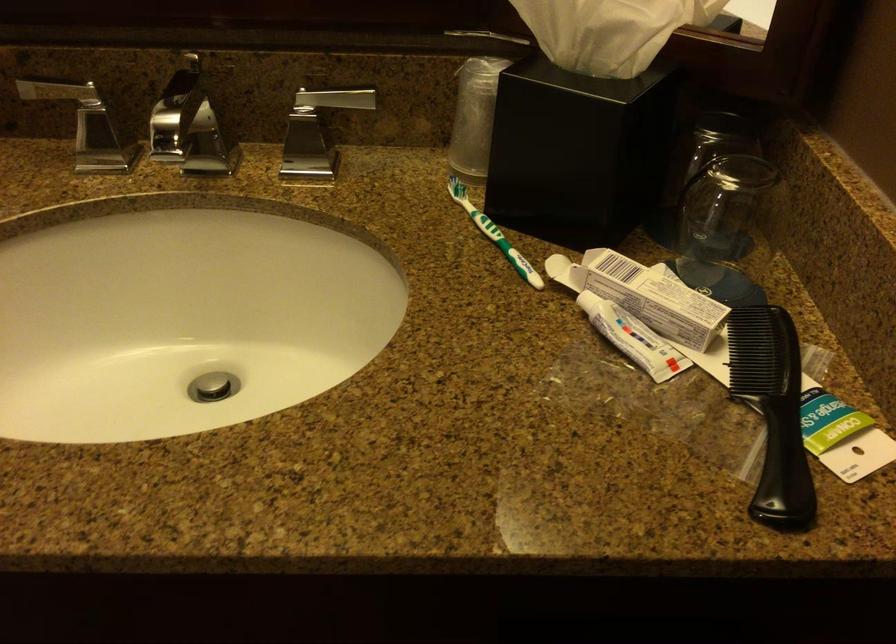
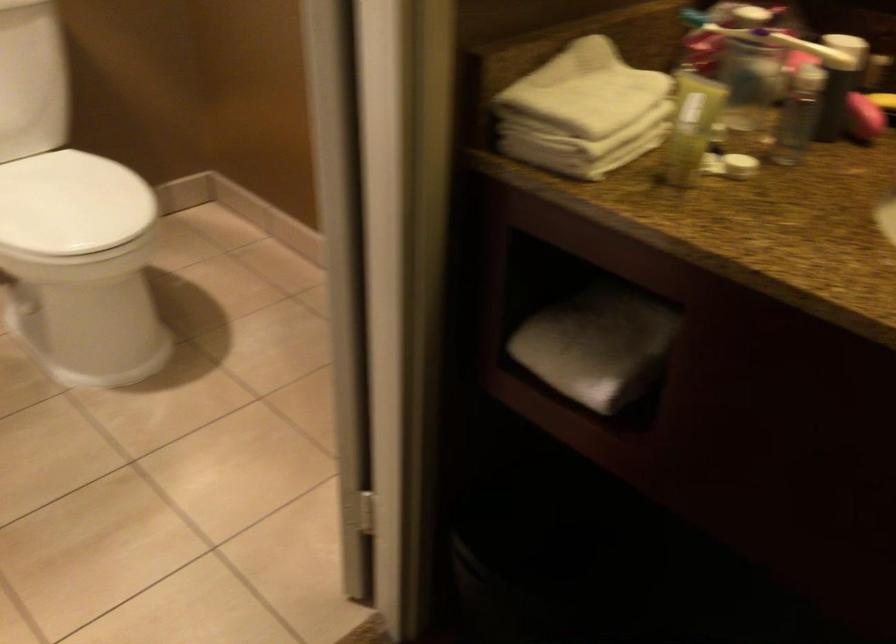
Question: Based on the continuous images, in which direction is the camera rotating? Reply with the corresponding letter.

Choices:
 (A) Left
 (B) Right
 (C) Up
 (D) Down

Answer: (A)